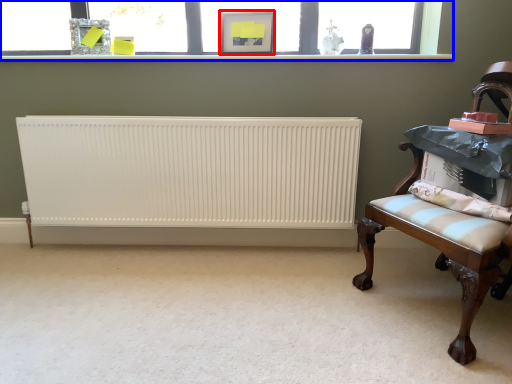
Question: Which object is further to the camera taking this photo, picture frame (highlighted by a red box) or window (highlighted by a blue box)?

Choices:
 (A) picture frame
 (B) window

Answer: (B)